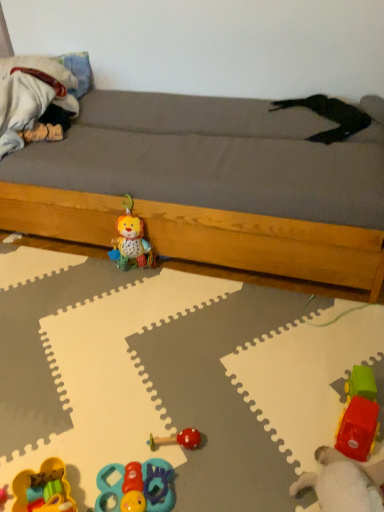
You are a GUI agent. You are given a task and a screenshot of the screen. Output one action in this format:
    pyautogui.click(x=<x>, y=<y>)
    Task: Click on the free point to the right of rubberized blue and red toy at lower center, which appears as the third toy when viewed from the left
    The width and height of the screenshot is (384, 512).
    Given the screenshot: What is the action you would take?
    pyautogui.click(x=215, y=472)